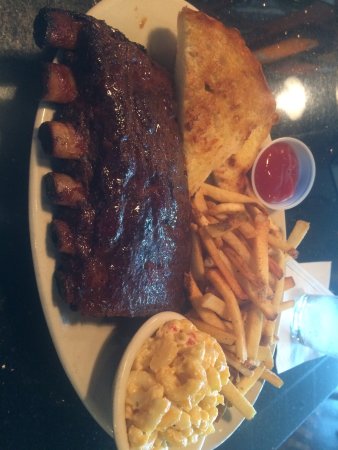
Where is `plate`? The image size is (338, 450). plate is located at coordinates (86, 355).